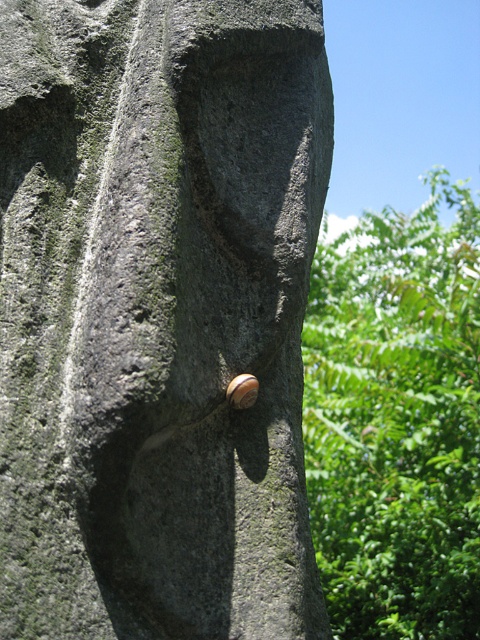
Does point (100, 336) lie in front of point (245, 396)?

Yes, it is.

Is point (272, 330) in front of point (232, 403)?

That is False.

This screenshot has width=480, height=640. I want to click on smooth gray stone at center, so click(157, 316).

Is green leafy tree at upper right above shiny brown shell at center?

No.

You are a GUI agent. You are given a task and a screenshot of the screen. Output one action in this format:
    pyautogui.click(x=<x>, y=<y>)
    Task: Click on the green leafy tree at upper right
    Image resolution: width=480 pixels, height=640 pixels.
    Given the screenshot: What is the action you would take?
    pyautogui.click(x=396, y=420)

You are a GUI agent. You are given a task and a screenshot of the screen. Output one action in this format:
    pyautogui.click(x=<x>, y=<y>)
    Task: Click on the green leafy tree at upper right
    
    Given the screenshot: What is the action you would take?
    pyautogui.click(x=396, y=420)

Can you confirm if smooth gray stone at center is thinner than green leafy tree at upper right?

Correct, smooth gray stone at center's width is less than green leafy tree at upper right's.

How much distance is there between smooth gray stone at center and green leafy tree at upper right?

A distance of 5.33 feet exists between smooth gray stone at center and green leafy tree at upper right.

Between point (129, 426) and point (459, 582), which one is positioned in front?

Positioned in front is point (129, 426).

Find the location of `smooth gray stone at center`. smooth gray stone at center is located at coordinates (157, 316).